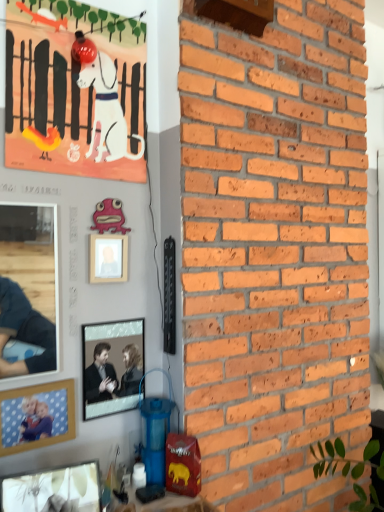
The height and width of the screenshot is (512, 384). What do you see at coordinates (75, 90) in the screenshot?
I see `matte paper poster at upper left` at bounding box center [75, 90].

What do you see at coordinates (108, 258) in the screenshot? The width and height of the screenshot is (384, 512). I see `pink wood picture frame at upper center, arranged as the 1th picture frame when viewed from the back` at bounding box center [108, 258].

The height and width of the screenshot is (512, 384). In order to click on wooden picture frame at lower left, which is the third picture frame in back-to-front order in this screenshot , I will do `click(36, 416)`.

Is there a large distance between matte glass picture frame at lower left, which ranks as the first picture frame in front-to-back order, and matte paper poster at upper left?

matte glass picture frame at lower left, which ranks as the first picture frame in front-to-back order, is far away from matte paper poster at upper left.

In terms of width, does matte glass picture frame at lower left, marked as the fourth picture frame in a back-to-front arrangement, look wider or thinner when compared to matte paper poster at upper left?

Considering their sizes, matte glass picture frame at lower left, marked as the fourth picture frame in a back-to-front arrangement, looks broader than matte paper poster at upper left.

Between matte glass picture frame at lower left, which ranks as the first picture frame in front-to-back order, and matte paper poster at upper left, which one has more height?

matte paper poster at upper left is taller.

Consider the image. Can you confirm if metallic silver picture frame at center, which is the 3th picture frame in bottom-to-top order, is smaller than wooden picture frame at lower left, the second picture frame when ordered from bottom to top?

Incorrect, metallic silver picture frame at center, which is the 3th picture frame in bottom-to-top order, is not smaller in size than wooden picture frame at lower left, the second picture frame when ordered from bottom to top.

Is metallic silver picture frame at center, which appears as the 2th picture frame when viewed from the back, closer to camera compared to wooden picture frame at lower left, the second picture frame when ordered from bottom to top?

No.

Does matte glass picture frame at lower left, which is counted as the fourth picture frame, starting from the top, have a greater width compared to metallic silver picture frame at center, which is the 3th picture frame in bottom-to-top order?

Indeed, matte glass picture frame at lower left, which is counted as the fourth picture frame, starting from the top, has a greater width compared to metallic silver picture frame at center, which is the 3th picture frame in bottom-to-top order.

Is point (60, 506) more distant than point (130, 347)?

No, it is not.

Who is bigger, matte glass picture frame at lower left, marked as the fourth picture frame in a back-to-front arrangement, or metallic silver picture frame at center, which appears as the 2th picture frame when viewed from the back?

With larger size is matte glass picture frame at lower left, marked as the fourth picture frame in a back-to-front arrangement.

Based on the photo, from the image's perspective, which object appears higher, matte glass picture frame at lower left, the 1th picture frame when ordered from bottom to top, or metallic silver picture frame at center, which is the 3th picture frame in bottom-to-top order?

metallic silver picture frame at center, which is the 3th picture frame in bottom-to-top order, from the image's perspective.

Considering the sizes of objects metallic silver picture frame at center, which appears as the 2th picture frame when viewed from the back, and pink wood picture frame at upper center, arranged as the first picture frame when viewed from the top, in the image provided, who is taller, metallic silver picture frame at center, which appears as the 2th picture frame when viewed from the back, or pink wood picture frame at upper center, arranged as the first picture frame when viewed from the top,?

With more height is metallic silver picture frame at center, which appears as the 2th picture frame when viewed from the back.

From a real-world perspective, does metallic silver picture frame at center, the 2th picture frame in the top-to-bottom sequence, sit lower than pink wood picture frame at upper center, arranged as the first picture frame when viewed from the top?

Yes, from a real-world perspective, metallic silver picture frame at center, the 2th picture frame in the top-to-bottom sequence, is under pink wood picture frame at upper center, arranged as the first picture frame when viewed from the top.

From the image's perspective, is metallic silver picture frame at center, which ranks as the 3th picture frame in front-to-back order, above matte glass picture frame at lower left, which is counted as the fourth picture frame, starting from the top?

Yes, from the image's perspective, metallic silver picture frame at center, which ranks as the 3th picture frame in front-to-back order, is on top of matte glass picture frame at lower left, which is counted as the fourth picture frame, starting from the top.

I want to click on the 2nd picture frame counting from the right side of the matte glass picture frame at lower left, which ranks as the first picture frame in front-to-back order, so click(x=112, y=366).

Looking at this image, is metallic silver picture frame at center, which appears as the 2th picture frame when viewed from the back, wider or thinner than matte glass picture frame at lower left, the 1th picture frame when ordered from bottom to top?

In the image, metallic silver picture frame at center, which appears as the 2th picture frame when viewed from the back, appears to be more narrow than matte glass picture frame at lower left, the 1th picture frame when ordered from bottom to top.

Does point (118, 407) appear closer or farther from the camera than point (14, 503)?

Point (118, 407) is positioned farther from the camera compared to point (14, 503).

Is point (24, 406) more distant than point (93, 247)?

No.

Considering the sizes of objects wooden picture frame at lower left, the second picture frame when ordered from bottom to top, and pink wood picture frame at upper center, which is the 4th picture frame in front-to-back order, in the image provided, who is smaller, wooden picture frame at lower left, the second picture frame when ordered from bottom to top, or pink wood picture frame at upper center, which is the 4th picture frame in front-to-back order,?

Smaller between the two is wooden picture frame at lower left, the second picture frame when ordered from bottom to top.

From a real-world perspective, is wooden picture frame at lower left, which is the third picture frame in back-to-front order, below pink wood picture frame at upper center, which is the 4th picture frame in front-to-back order?

Yes, from a real-world perspective, wooden picture frame at lower left, which is the third picture frame in back-to-front order, is under pink wood picture frame at upper center, which is the 4th picture frame in front-to-back order.

From the image's perspective, which is below, wooden picture frame at lower left, the second picture frame in the front-to-back sequence, or pink wood picture frame at upper center, marked as the 4th picture frame in a bottom-to-top arrangement?

wooden picture frame at lower left, the second picture frame in the front-to-back sequence, is shown below in the image.

Considering the sizes of matte paper poster at upper left and metallic silver picture frame at center, which appears as the 2th picture frame when viewed from the back, in the image, is matte paper poster at upper left bigger or smaller than metallic silver picture frame at center, which appears as the 2th picture frame when viewed from the back,?

Clearly, matte paper poster at upper left is larger in size than metallic silver picture frame at center, which appears as the 2th picture frame when viewed from the back.

Is matte paper poster at upper left thinner than metallic silver picture frame at center, which ranks as the 3th picture frame in front-to-back order?

Yes.

Considering the points (30, 110) and (104, 393), which point is behind, point (30, 110) or point (104, 393)?

Point (104, 393)

Is matte paper poster at upper left surrounding metallic silver picture frame at center, the 2th picture frame in the top-to-bottom sequence?

No, matte paper poster at upper left does not contain metallic silver picture frame at center, the 2th picture frame in the top-to-bottom sequence.

From a real-world perspective, which picture frame is the 4th one underneath the matte paper poster at upper left? Please provide its 2D coordinates.

[(53, 490)]

Find the location of `picture frame that is the 1st one when counting downward from the metallic silver picture frame at center, which is the 3th picture frame in bottom-to-top order (from the image's perspective)`. picture frame that is the 1st one when counting downward from the metallic silver picture frame at center, which is the 3th picture frame in bottom-to-top order (from the image's perspective) is located at coordinates (36, 416).

From the picture: Which object lies nearer to the anchor point matte glass picture frame at lower left, marked as the fourth picture frame in a back-to-front arrangement, pink wood picture frame at upper center, marked as the 4th picture frame in a bottom-to-top arrangement, or metallic silver picture frame at center, which appears as the 2th picture frame when viewed from the back?

metallic silver picture frame at center, which appears as the 2th picture frame when viewed from the back, lies closer to matte glass picture frame at lower left, marked as the fourth picture frame in a back-to-front arrangement, than the other object.

Estimate the real-world distances between objects in this image. Which object is closer to wooden picture frame at lower left, the second picture frame when ordered from bottom to top, matte paper poster at upper left or matte glass picture frame at lower left, which ranks as the first picture frame in front-to-back order?

The object closer to wooden picture frame at lower left, the second picture frame when ordered from bottom to top, is matte glass picture frame at lower left, which ranks as the first picture frame in front-to-back order.

Which object lies further to the anchor point pink wood picture frame at upper center, which is the 4th picture frame in front-to-back order, wooden picture frame at lower left, the second picture frame when ordered from bottom to top, or matte glass picture frame at lower left, which is counted as the fourth picture frame, starting from the top?

matte glass picture frame at lower left, which is counted as the fourth picture frame, starting from the top, is positioned further to the anchor pink wood picture frame at upper center, which is the 4th picture frame in front-to-back order.

When comparing their distances from matte glass picture frame at lower left, which ranks as the first picture frame in front-to-back order, does metallic silver picture frame at center, which appears as the 2th picture frame when viewed from the back, or pink wood picture frame at upper center, marked as the 4th picture frame in a bottom-to-top arrangement, seem further?

The object further to matte glass picture frame at lower left, which ranks as the first picture frame in front-to-back order, is pink wood picture frame at upper center, marked as the 4th picture frame in a bottom-to-top arrangement.

Estimate the real-world distances between objects in this image. Which object is closer to matte glass picture frame at lower left, which is counted as the fourth picture frame, starting from the top, wooden picture frame at lower left, the second picture frame in the front-to-back sequence, or pink wood picture frame at upper center, arranged as the 1th picture frame when viewed from the back?

wooden picture frame at lower left, the second picture frame in the front-to-back sequence, is positioned closer to the anchor matte glass picture frame at lower left, which is counted as the fourth picture frame, starting from the top.

Based on their spatial positions, is matte glass picture frame at lower left, the 1th picture frame when ordered from bottom to top, or matte paper poster at upper left closer to wooden picture frame at lower left, the second picture frame in the front-to-back sequence?

Among the two, matte glass picture frame at lower left, the 1th picture frame when ordered from bottom to top, is located nearer to wooden picture frame at lower left, the second picture frame in the front-to-back sequence.

Looking at the image, which one is located further to pink wood picture frame at upper center, arranged as the 1th picture frame when viewed from the back, matte glass picture frame at lower left, marked as the fourth picture frame in a back-to-front arrangement, or matte paper poster at upper left?

Among the two, matte glass picture frame at lower left, marked as the fourth picture frame in a back-to-front arrangement, is located further to pink wood picture frame at upper center, arranged as the 1th picture frame when viewed from the back.

From the image, which object appears to be farther from wooden picture frame at lower left, which is the third picture frame in back-to-front order, matte paper poster at upper left or metallic silver picture frame at center, which ranks as the 3th picture frame in front-to-back order?

matte paper poster at upper left.

Identify the location of picture frame between matte glass picture frame at lower left, marked as the fourth picture frame in a back-to-front arrangement, and metallic silver picture frame at center, which appears as the 2th picture frame when viewed from the back, from front to back. The image size is (384, 512). (36, 416).

Where is `picture frame that lies between matte paper poster at upper left and metallic silver picture frame at center, the 2th picture frame in the top-to-bottom sequence, from top to bottom`? This screenshot has width=384, height=512. picture frame that lies between matte paper poster at upper left and metallic silver picture frame at center, the 2th picture frame in the top-to-bottom sequence, from top to bottom is located at coordinates (108, 258).

Image resolution: width=384 pixels, height=512 pixels. I want to click on picture frame between pink wood picture frame at upper center, arranged as the first picture frame when viewed from the top, and wooden picture frame at lower left, the third picture frame from the top, in the up-down direction, so point(112,366).